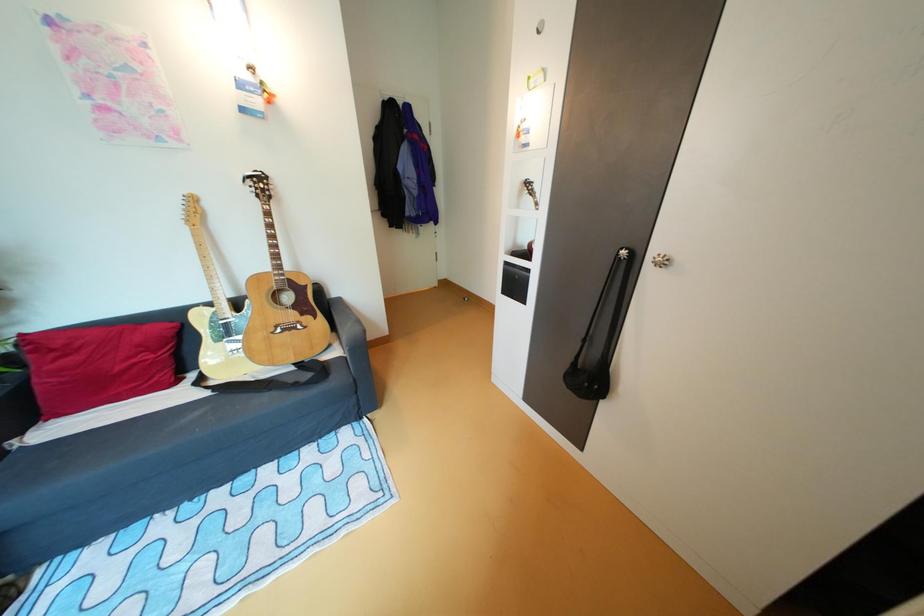
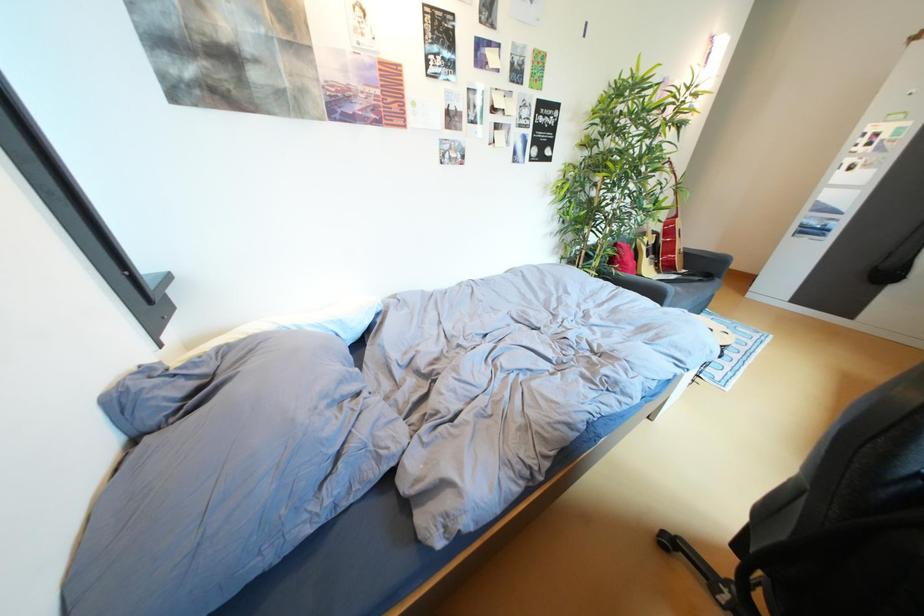
Question: The images are taken continuously from a first-person perspective. In which direction are you moving?

Choices:
 (A) Left
 (B) Right
 (C) Forward
 (D) Backward

Answer: (A)